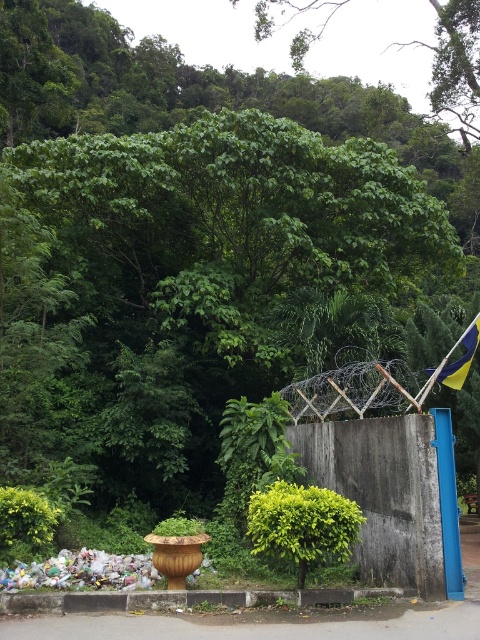
You are standing at the point labeled as point [455,67]. Looking around, you see a green leafy tree at upper center. Which direction should you face to see the concrete wall with blue metal structure on its right side?

The point [455,67] is located on the green leafy tree at upper center. To see the concrete wall with blue metal structure on its right side, you should face downward and to the right since the wall is positioned lower in the scene compared to the tree.

You are a landscape designer evaluating the scene. You notice the green leafy tree at upper center and the plastic trash at lower left. Which object would you prioritize for maintenance based on their sizes?

The green leafy tree at upper center is larger in size than the plastic trash at lower left, so you should prioritize maintaining the green leafy tree at upper center first.

You are a park maintenance worker who needs to clean up the area. You see the plastic trash at lower left and the yellow fabric flag at right. Which item should you prioritize picking up first based on their sizes?

The plastic trash at lower left is bigger than the yellow fabric flag at right, so you should prioritize picking up the plastic trash at lower left first.